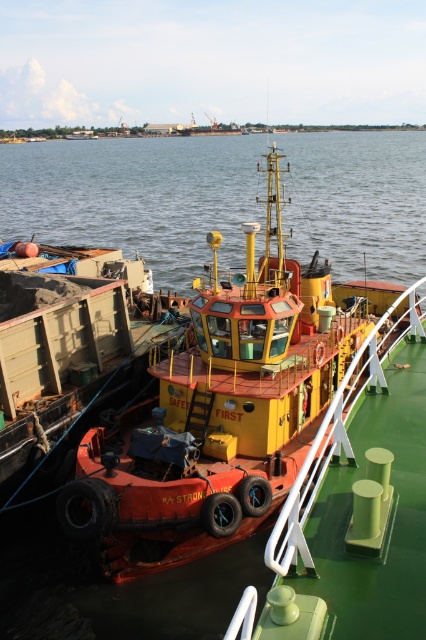
Question: Does orange rubber boat at center come in front of clear water at center?

Choices:
 (A) no
 (B) yes

Answer: (B)

Question: Does orange rubber boat at center appear on the left side of rusty metal cargo container at left?

Choices:
 (A) yes
 (B) no

Answer: (B)

Question: Considering the real-world distances, which object is closest to the rusty metal cargo container at left?

Choices:
 (A) clear water at center
 (B) orange rubber boat at center

Answer: (B)

Question: Which point appears farthest from the camera in this image?

Choices:
 (A) (114, 305)
 (B) (127, 515)
 (C) (81, 196)

Answer: (C)

Question: Is clear water at center wider than rusty metal cargo container at left?

Choices:
 (A) no
 (B) yes

Answer: (B)

Question: Among these points, which one is farthest from the camera?

Choices:
 (A) (333, 140)
 (B) (75, 298)
 (C) (245, 252)

Answer: (A)